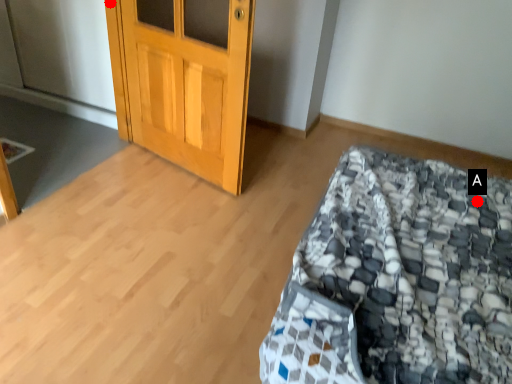
Question: Two points are circled on the image, labeled by A and B beside each circle. Among these points, which one is nearest to the camera?

Choices:
 (A) A is closer
 (B) B is closer

Answer: (A)